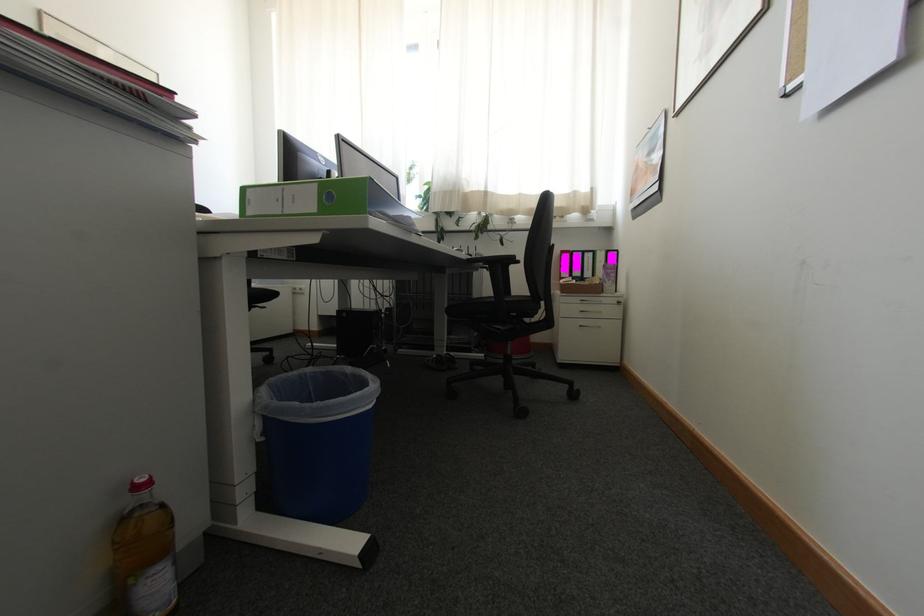
What are the coordinates of `chair armrest` in the screenshot? It's located at (492, 261).